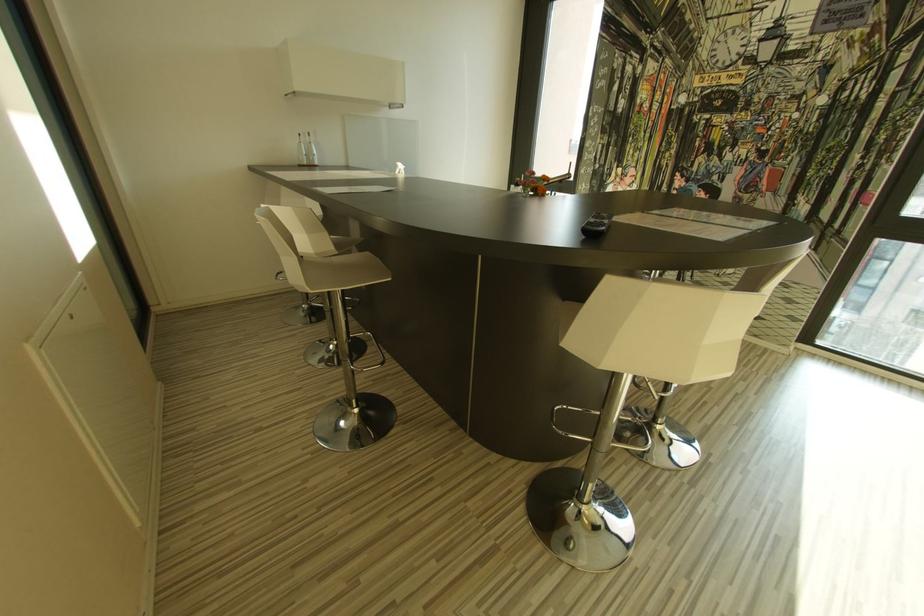
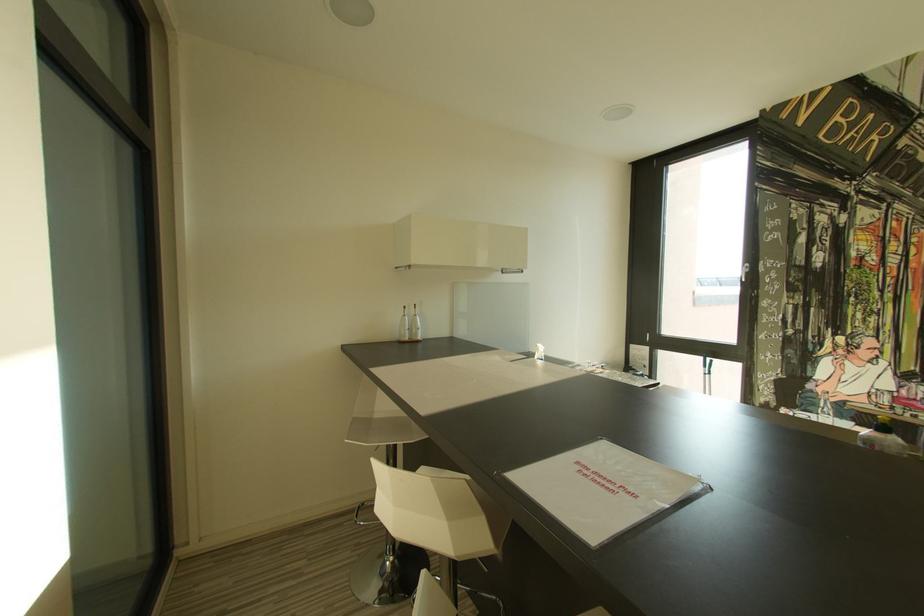
What movement of the cameraman would produce the second image?

The movement direction of the cameraman is left, forward.